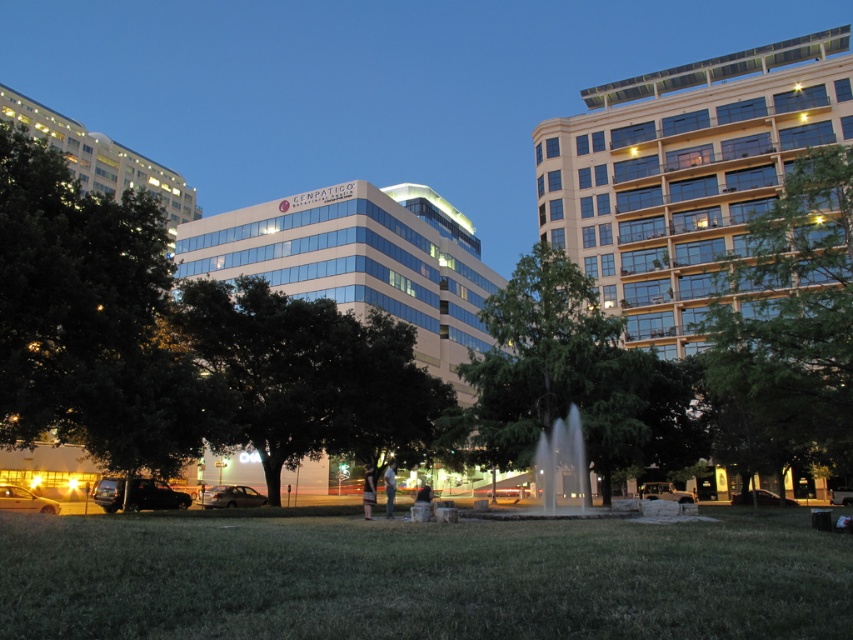
Does gold glass building at upper right have a lesser height compared to white glass building at center?

Yes.

How distant is gold glass building at upper right from white glass building at center?

gold glass building at upper right and white glass building at center are 28.32 meters apart from each other.

Based on the photo, who is more distant from viewer, (706, 209) or (401, 192)?

The point (401, 192) is behind.

Locate an element on the screen. gold glass building at upper right is located at coordinates (683, 172).

Can you confirm if gold glass building at upper right is positioned to the left of green leafy tree at center?

No, gold glass building at upper right is not to the left of green leafy tree at center.

Find the location of a particular element. This screenshot has height=640, width=853. gold glass building at upper right is located at coordinates (683, 172).

Who is more forward, (828, 92) or (479, 428)?

Point (479, 428) is more forward.

The height and width of the screenshot is (640, 853). What are the coordinates of `gold glass building at upper right` in the screenshot? It's located at 683,172.

Describe the element at coordinates (787, 326) in the screenshot. I see `green leafy tree at right` at that location.

Where is `green leafy tree at right`? green leafy tree at right is located at coordinates (787, 326).